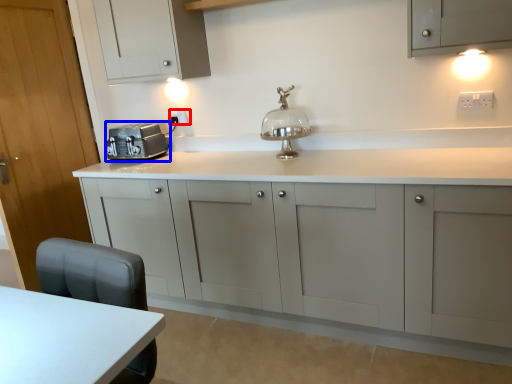
Question: Which point is further to the camera, electric outlet (highlighted by a red box) or home appliance (highlighted by a blue box)?

Choices:
 (A) electric outlet
 (B) home appliance

Answer: (A)